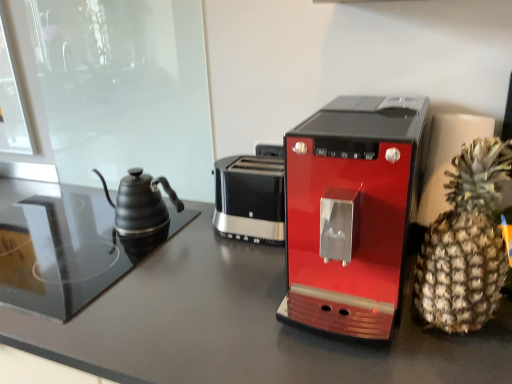
Identify the location of blank space to the left of brown spiky pineapple at right. The image size is (512, 384). (360, 332).